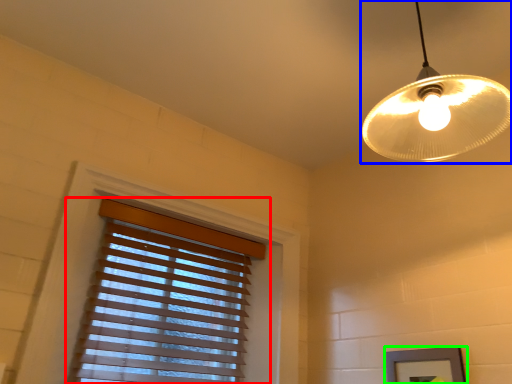
Question: Which is nearer to the window blind (highlighted by a red box)? lamp (highlighted by a blue box) or picture frame (highlighted by a green box).

Choices:
 (A) lamp
 (B) picture frame

Answer: (B)